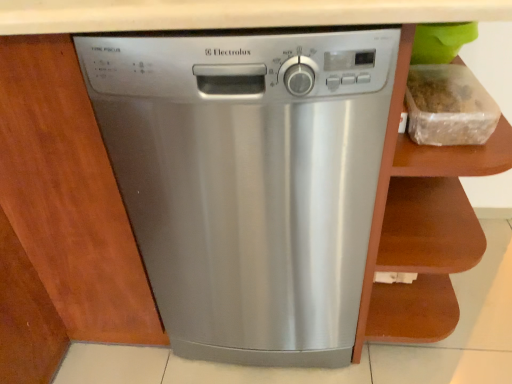
Question: Which is correct: stainless steel dishwasher at center is inside clear plastic container at upper right, or outside of it?

Choices:
 (A) inside
 (B) outside

Answer: (B)

Question: Considering the positions of stainless steel dishwasher at center and clear plastic container at upper right in the image, is stainless steel dishwasher at center wider or thinner than clear plastic container at upper right?

Choices:
 (A) thin
 (B) wide

Answer: (B)

Question: Which of these objects is positioned farthest from the brown wood cabinet at right?

Choices:
 (A) stainless steel dishwasher at center
 (B) clear plastic container at upper right

Answer: (B)

Question: Which object is positioned farthest from the stainless steel dishwasher at center?

Choices:
 (A) brown wood cabinet at right
 (B) clear plastic container at upper right

Answer: (B)